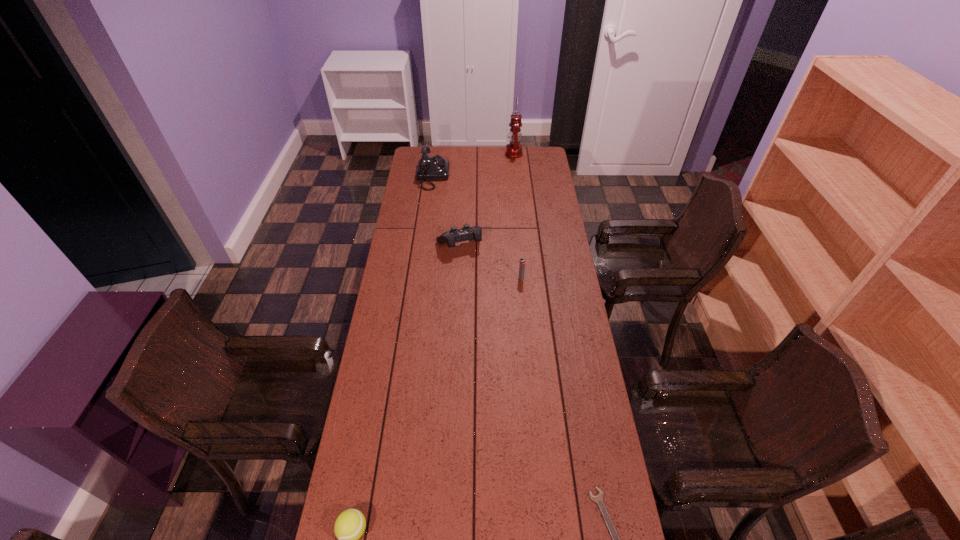
You are a GUI agent. You are given a task and a screenshot of the screen. Output one action in this format:
    pyautogui.click(x=<x>, y=<y>)
    Task: Click on the oil lamp present at the far edge
    
    Given the screenshot: What is the action you would take?
    pyautogui.click(x=514, y=149)

Locate an element on the screen. telephone that is positioned at the far edge is located at coordinates (430, 168).

This screenshot has width=960, height=540. In order to click on object located at the left edge in this screenshot , I will do `click(430, 168)`.

I want to click on object at the right edge, so click(514, 149).

Locate an element on the screen. The image size is (960, 540). object positioned at the far left corner is located at coordinates (430, 168).

In order to click on object at the far right corner in this screenshot , I will do `click(514, 149)`.

In the image, there is a desktop. Where is `vacant space at the far edge`? vacant space at the far edge is located at coordinates (485, 162).

Find the location of `vacant region at the left edge of the desktop`. vacant region at the left edge of the desktop is located at coordinates (410, 245).

Find the location of a particular element. The width and height of the screenshot is (960, 540). free spot at the right edge of the desktop is located at coordinates (595, 415).

The width and height of the screenshot is (960, 540). Identify the location of vacant area at the far left corner. (416, 154).